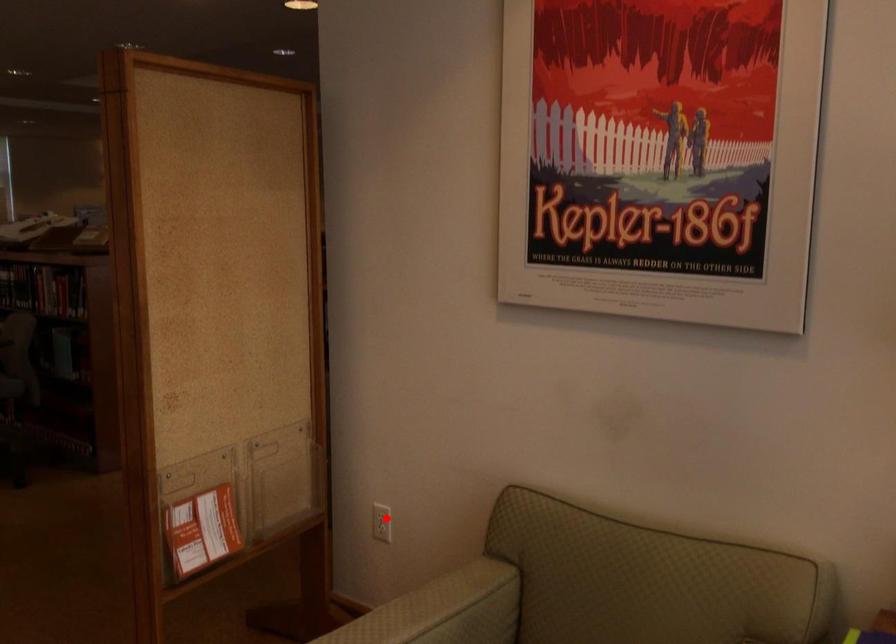
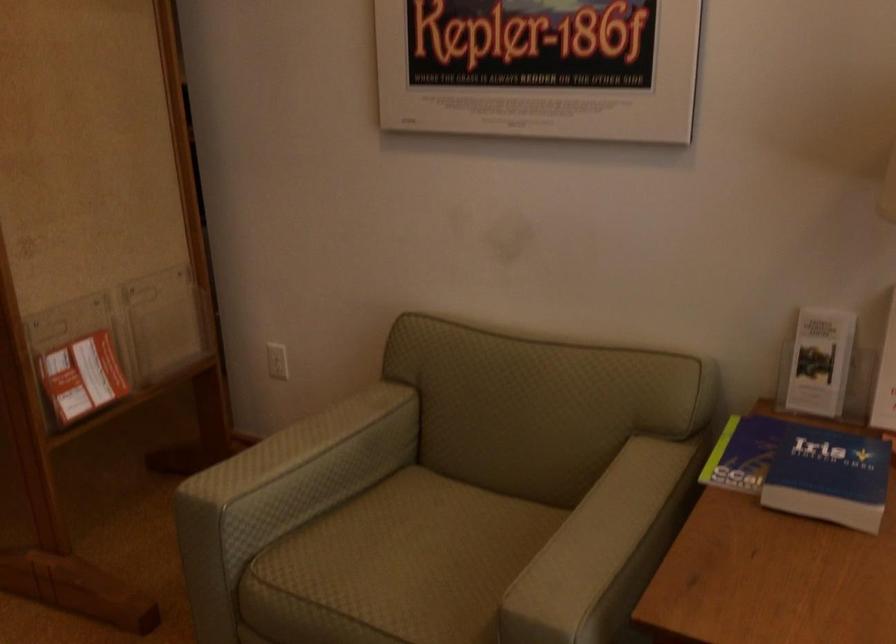
In the second image, find the point that corresponds to the highlighted location in the first image.

(277, 361)